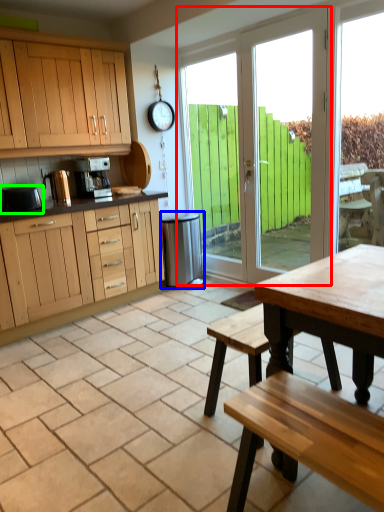
Question: Which object is the farthest from door (highlighted by a red box)? Choose among these: appliance (highlighted by a blue box) or appliance (highlighted by a green box).

Choices:
 (A) appliance
 (B) appliance

Answer: (B)